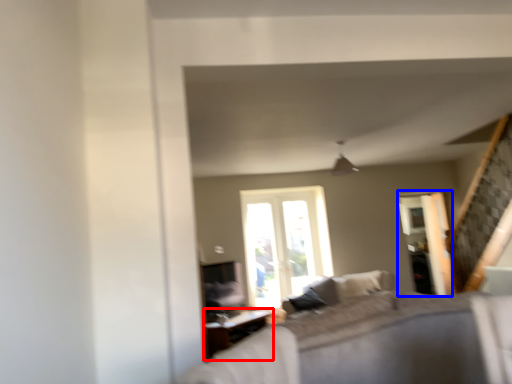
Question: Which point is closer to the camera, table (highlighted by a red box) or screen door (highlighted by a blue box)?

Choices:
 (A) table
 (B) screen door

Answer: (A)